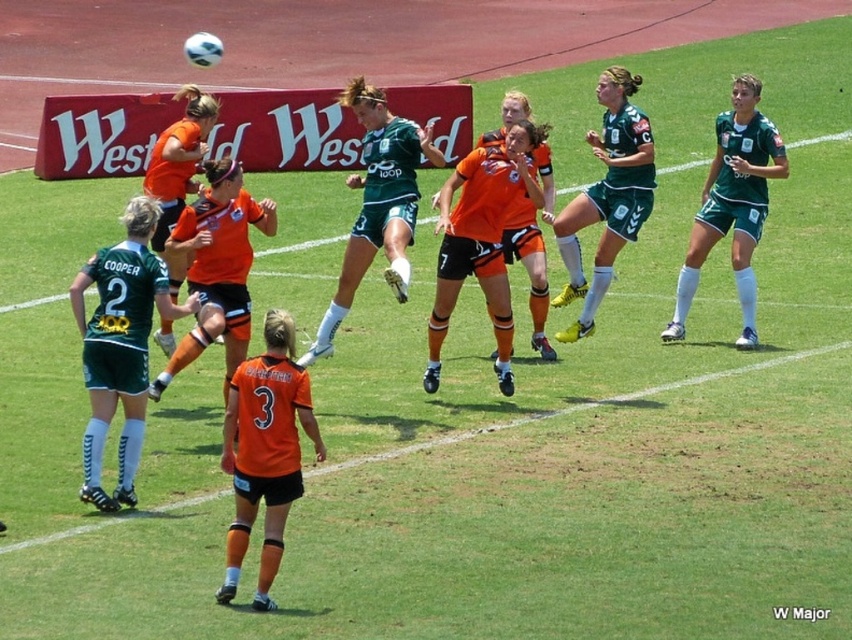
You are a soccer referee standing at the center of the field. You need to determine which of the two points, point (772, 134) or point (626, 140), is closer to the camera. Which one is closer?

Point (626, 140) is closer to the camera than point (772, 134) because the description states that point (772, 134) is further away.

You are a soccer coach standing on the sideline and want to give instructions to the player wearing green matte shorts at right. Considering the distance between you and the player, can you shout instructions clearly without needing a megaphone?

The distance between green matte shorts at right and the viewer is 11.74 meters. Since shouting can typically be heard up to 10 meters, you would need a megaphone to communicate clearly.

From the picture: You are a soccer referee positioned at the center of the field. You need to determine the position of the green jersey at center relative to the point marked at coordinates (377, 204). Is the green jersey at center located at, above, below, to the left, or to the right of this point?

The point at coordinates (377, 204) corresponds to the green jersey at center, so the green jersey at center is located at this point.